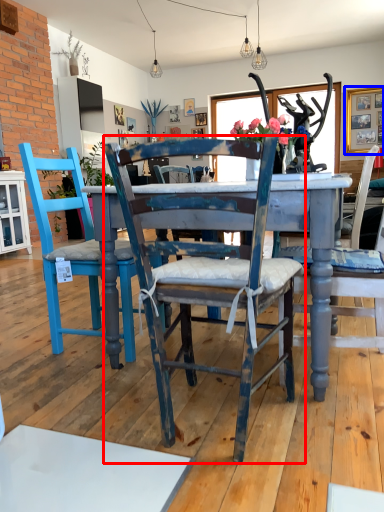
Question: Which point is closer to the camera, chair (highlighted by a red box) or picture frame (highlighted by a blue box)?

Choices:
 (A) chair
 (B) picture frame

Answer: (A)